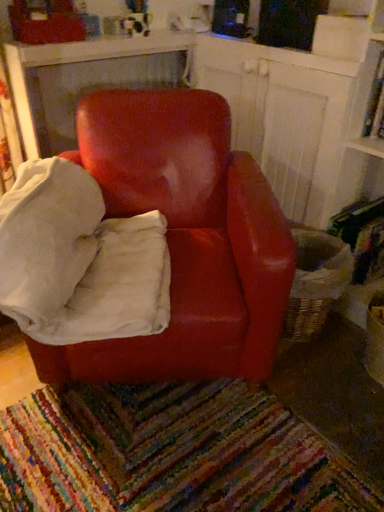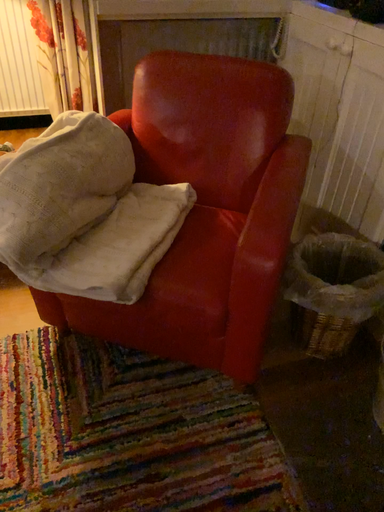
Question: Which way did the camera rotate in the video?

Choices:
 (A) rotated left
 (B) rotated right

Answer: (A)